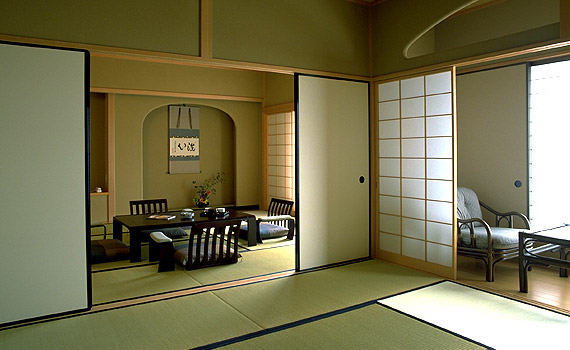
At what (x,y) coordinates should I click in order to perform the action: click on wall hanging. Please return your answer as a coordinate pair (x, y). Looking at the image, I should click on (181, 130).